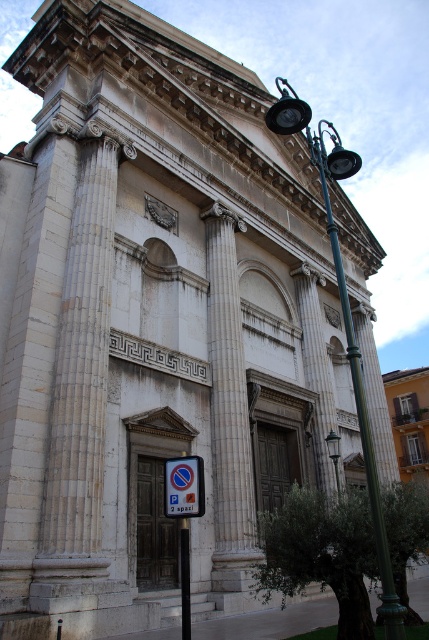
Question: Which point is farther from the camera taking this photo?

Choices:
 (A) (181, 477)
 (B) (287, 132)

Answer: (B)

Question: Can you confirm if green metal streetlight at upper right is positioned to the right of blue plastic parking sign at lower center?

Choices:
 (A) no
 (B) yes

Answer: (B)

Question: Which point is farther from the camera taking this photo?

Choices:
 (A) (199, 508)
 (B) (184, 576)
 (C) (353, 355)

Answer: (A)

Question: Does green metal streetlight at upper right come in front of white plastic parking sign at lower center?

Choices:
 (A) no
 (B) yes

Answer: (B)

Question: Does green metal streetlight at upper right lie in front of blue plastic parking sign at lower center?

Choices:
 (A) no
 (B) yes

Answer: (B)

Question: Which point is closer to the camera?

Choices:
 (A) (196, 492)
 (B) (163, 486)
 (C) (337, 172)

Answer: (A)